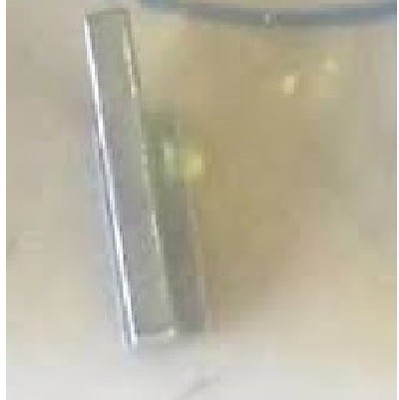
Where is `surface`? surface is located at coordinates (285, 240).